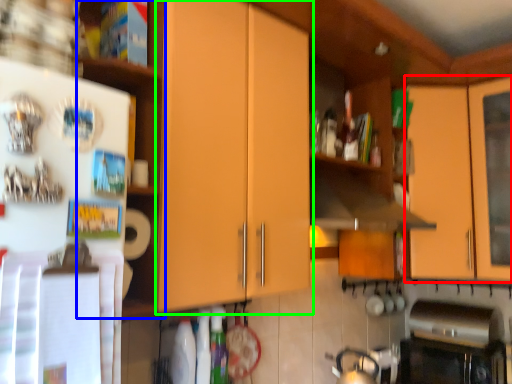
Question: Considering the real-world distances, which object is farthest from cabinetry (highlighted by a red box)? shelf (highlighted by a blue box) or cabinetry (highlighted by a green box)?

Choices:
 (A) shelf
 (B) cabinetry

Answer: (A)